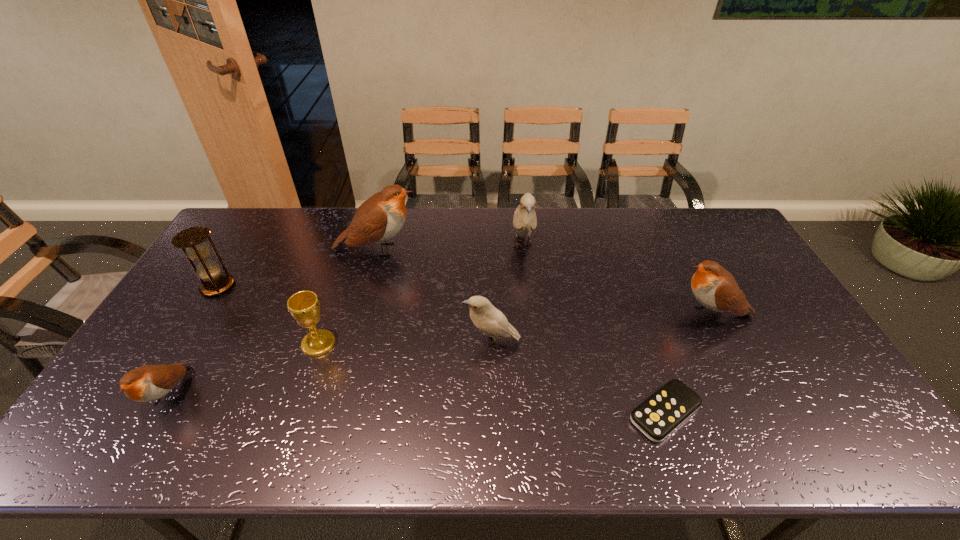
Locate an element on the screen. vacant position located at the beak of the nearer white bird is located at coordinates (431, 342).

Identify the location of vacant region located 0.290m at the beak of the nearer white bird. The width and height of the screenshot is (960, 540). (360, 342).

The width and height of the screenshot is (960, 540). What are the coordinates of `free location located 0.070m on the left of the chalice` in the screenshot? It's located at (277, 343).

Image resolution: width=960 pixels, height=540 pixels. What are the coordinates of `free region located on the right of the seventh object from left to right` in the screenshot? It's located at (821, 412).

I want to click on bird at the near edge, so click(x=147, y=383).

Identify the location of remote control at the near edge. The width and height of the screenshot is (960, 540). (658, 416).

Where is `hourglass at the left edge`? The image size is (960, 540). hourglass at the left edge is located at coordinates (208, 271).

Where is `bird that is positioned at the left edge`? The height and width of the screenshot is (540, 960). bird that is positioned at the left edge is located at coordinates (147, 383).

Where is `object that is at the right edge`? The height and width of the screenshot is (540, 960). object that is at the right edge is located at coordinates (715, 288).

The width and height of the screenshot is (960, 540). I want to click on object that is at the near left corner, so click(147, 383).